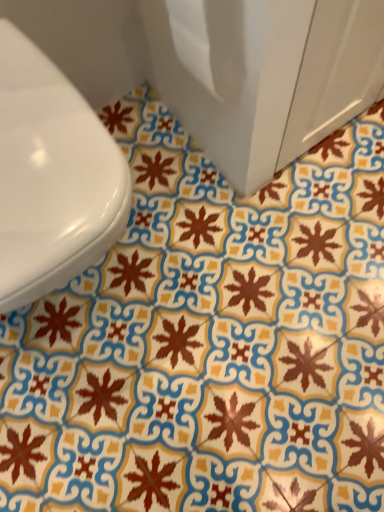
Image resolution: width=384 pixels, height=512 pixels. What do you see at coordinates (51, 176) in the screenshot?
I see `white glossy toilet at left` at bounding box center [51, 176].

The width and height of the screenshot is (384, 512). I want to click on white glossy toilet at left, so click(51, 176).

Measure the distance between point (x=45, y=136) and camera.

Point (x=45, y=136) and camera are 25.04 inches apart.

I want to click on white glossy toilet at left, so click(x=51, y=176).